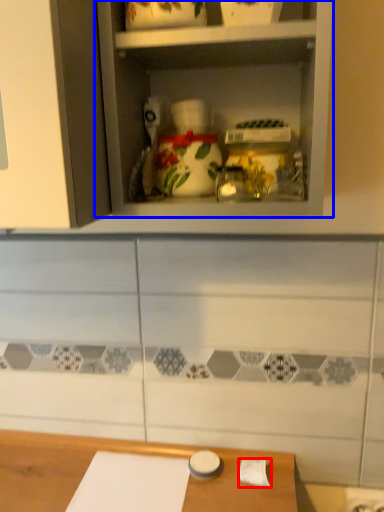
Question: Among these objects, which one is nearest to the camera, toilet paper (highlighted by a red box) or shelf (highlighted by a blue box)?

Choices:
 (A) toilet paper
 (B) shelf

Answer: (B)